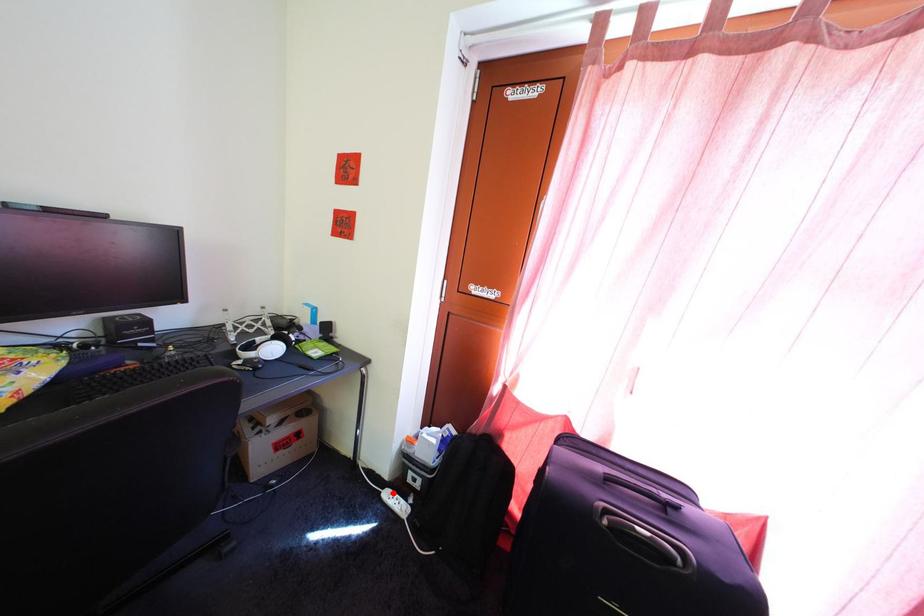
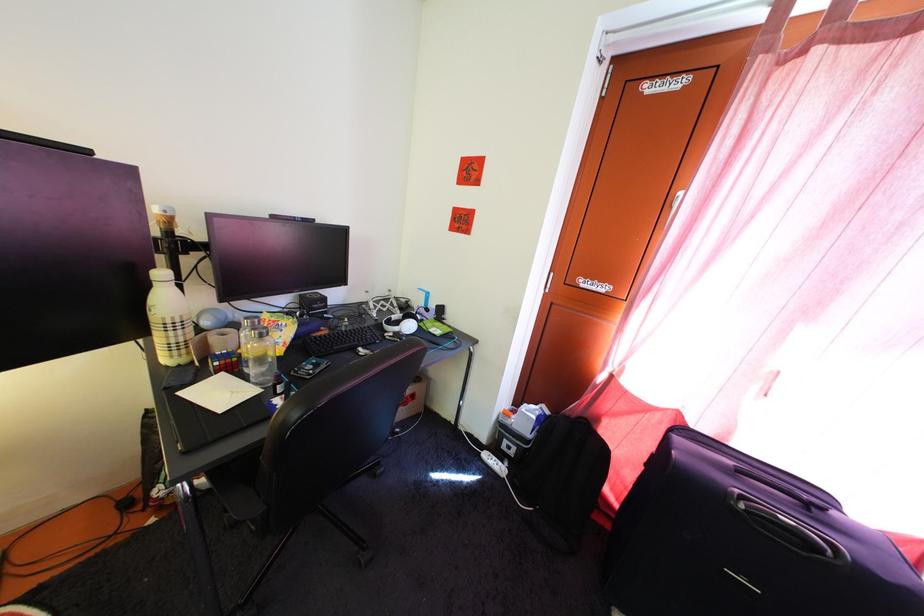
Question: A red point is marked in image1. In image2, is the corresponding 3D point closer to the camera or farther? Reply with the corresponding letter.

Choices:
 (A) The corresponding 3D point is closer.
 (B) The corresponding 3D point is farther.

Answer: (A)